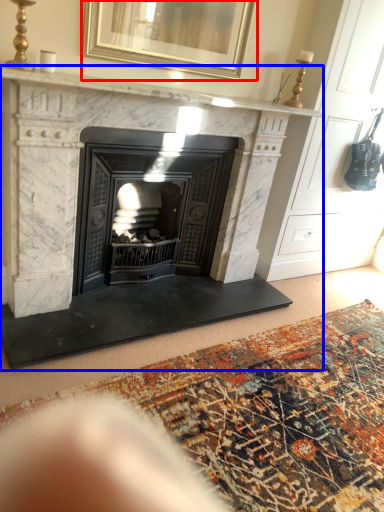
Question: Which object appears closest to the camera in this image, picture frame (highlighted by a red box) or fireplace (highlighted by a blue box)?

Choices:
 (A) picture frame
 (B) fireplace

Answer: (B)